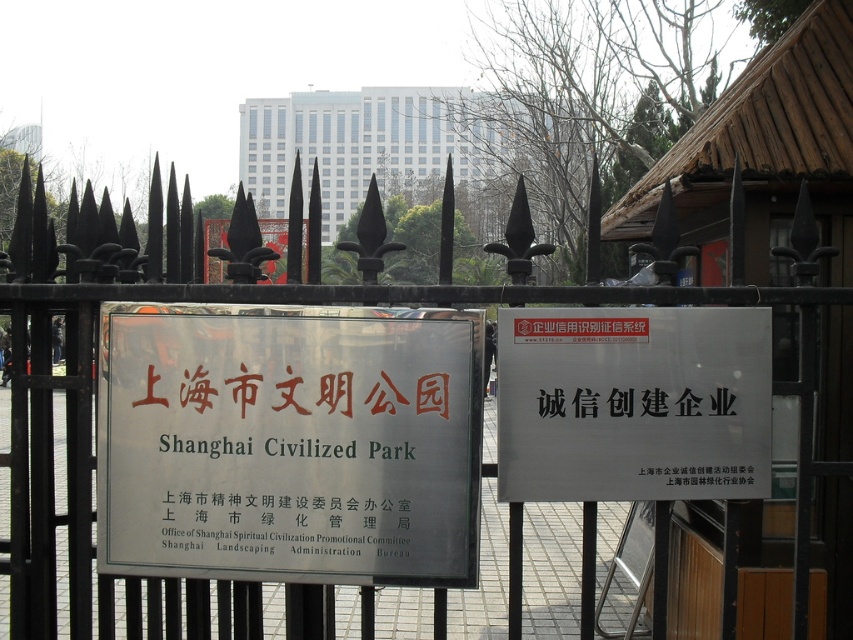
Is white plastic sign at center thinner than white glass building at upper center?

Yes, white plastic sign at center is thinner than white glass building at upper center.

Who is taller, white plastic sign at center or white glass building at upper center?

With more height is white glass building at upper center.

I want to click on white plastic sign at center, so (x=288, y=444).

Which is behind, point (791, 324) or point (641, 349)?

The point (791, 324) is more distant.

Does wooden hut at center have a smaller size compared to white matte sign at center?

Incorrect, wooden hut at center is not smaller in size than white matte sign at center.

Does point (833, 480) lie in front of point (665, 476)?

No, it is behind (665, 476).

The height and width of the screenshot is (640, 853). What are the coordinates of `wooden hut at center` in the screenshot? It's located at (764, 157).

Is white matte sign at center positioned behind black paper sign at center?

No.

Does white matte sign at center appear over black paper sign at center?

Yes, white matte sign at center is above black paper sign at center.

You are a GUI agent. You are given a task and a screenshot of the screen. Output one action in this format:
    pyautogui.click(x=<x>, y=<y>)
    Task: Click on the white matte sign at center
    
    Given the screenshot: What is the action you would take?
    pyautogui.click(x=633, y=403)

You are a GUI agent. You are given a task and a screenshot of the screen. Output one action in this format:
    pyautogui.click(x=<x>, y=<y>)
    Task: Click on the white matte sign at center
    The image size is (853, 640).
    Given the screenshot: What is the action you would take?
    (633, 403)